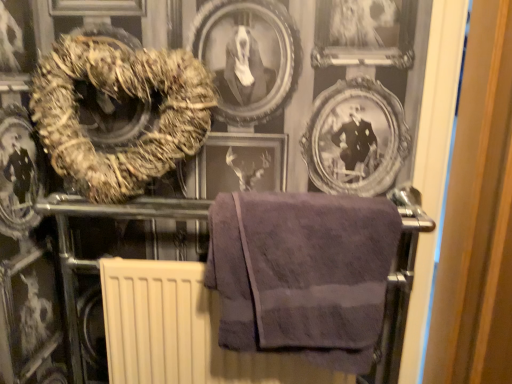
Where is `free space above purple cotton towel at center, which appears as the 1th towel when ordered from the bottom (from a real-world perspective)`? The height and width of the screenshot is (384, 512). free space above purple cotton towel at center, which appears as the 1th towel when ordered from the bottom (from a real-world perspective) is located at coordinates (293, 205).